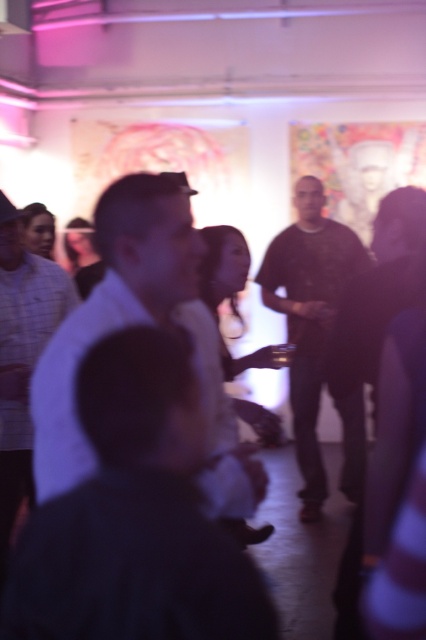
You are a photographer at the event and want to capture a clear photo of both the dark blue shirt at center and the white shirt at center. Given that your camera has a depth of field that can focus on objects within 10 inches of each other, will both subjects be in focus?

The distance between the dark blue shirt at center and white shirt at center is 12.28 inches. Since the camera can only focus on objects within 10 inches of each other, they will not both be in focus.

You are at a party and want to take a photo of the white shirt at center and dark gray shirt at center. Which one is positioned higher in the frame?

The white shirt at center is positioned higher in the frame than the dark gray shirt at center.